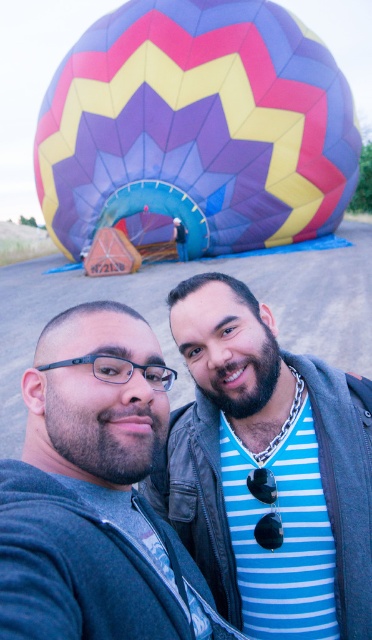
Does multicolored fabric balloon at upper center lie behind matte black jacket at center?

Yes, multicolored fabric balloon at upper center is further from the viewer.

Identify the location of multicolored fabric balloon at upper center. (200, 122).

Is point (215, 211) farther from camera compared to point (204, 310)?

Yes.

You are a GUI agent. You are given a task and a screenshot of the screen. Output one action in this format:
    pyautogui.click(x=<x>, y=<y>)
    Task: Click on the multicolored fabric balloon at upper center
    Image resolution: width=372 pixels, height=640 pixels.
    Given the screenshot: What is the action you would take?
    pyautogui.click(x=200, y=122)